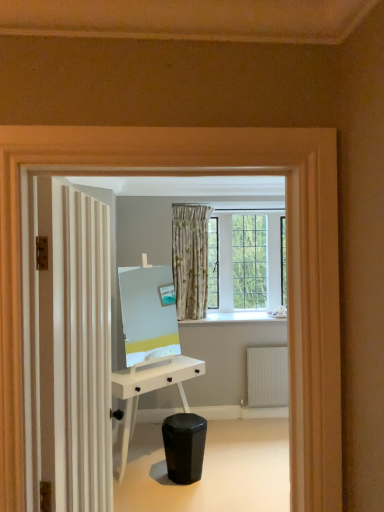
At what (x,y) coordinates should I click in order to perform the action: click on black matte swivel chair at lower center. Please return your answer as a coordinate pair (x, y). The height and width of the screenshot is (512, 384). Looking at the image, I should click on tap(184, 446).

Describe the element at coordinates (150, 391) in the screenshot. I see `white matte desk at center` at that location.

The width and height of the screenshot is (384, 512). In order to click on white textured door at left in this screenshot , I will do `click(75, 348)`.

Can you confirm if white textured door at left is positioned to the left of white ribbed radiator at lower right?

Yes, white textured door at left is to the left of white ribbed radiator at lower right.

Does white textured door at left have a lesser height compared to white ribbed radiator at lower right?

Incorrect, the height of white textured door at left does not fall short of that of white ribbed radiator at lower right.

Measure the distance between white textured door at left and white ribbed radiator at lower right.

A distance of 2.83 meters exists between white textured door at left and white ribbed radiator at lower right.

Is white textured door at left in contact with black matte swivel chair at lower center?

white textured door at left and black matte swivel chair at lower center are not in contact.

Is point (102, 379) farther from camera compared to point (174, 426)?

That is False.

From a real-world perspective, is white textured door at left on top of black matte swivel chair at lower center?

A: Correct, in the physical world, white textured door at left is higher than black matte swivel chair at lower center.

Can you confirm if white textured door at left is wider than black matte swivel chair at lower center?

In fact, white textured door at left might be narrower than black matte swivel chair at lower center.

Between black matte swivel chair at lower center and white textured door at left, which one has smaller width?

With smaller width is white textured door at left.

Considering their positions, is black matte swivel chair at lower center located in front of or behind white textured door at left?

Visually, black matte swivel chair at lower center is located behind white textured door at left.

Does black matte swivel chair at lower center appear on the left side of white textured door at left?

Incorrect, black matte swivel chair at lower center is not on the left side of white textured door at left.

Could you tell me if white ribbed radiator at lower right is facing black matte swivel chair at lower center?

No, white ribbed radiator at lower right does not turn towards black matte swivel chair at lower center.

How much distance is there between white ribbed radiator at lower right and black matte swivel chair at lower center?

A distance of 4.30 feet exists between white ribbed radiator at lower right and black matte swivel chair at lower center.

Looking at their sizes, would you say white ribbed radiator at lower right is wider or thinner than black matte swivel chair at lower center?

white ribbed radiator at lower right is thinner than black matte swivel chair at lower center.

Who is smaller, white ribbed radiator at lower right or black matte swivel chair at lower center?

white ribbed radiator at lower right.

What's the angular difference between white ribbed radiator at lower right and white textured door at left's facing directions?

The angle between the facing direction of white ribbed radiator at lower right and the facing direction of white textured door at left is 81.1 degrees.

Is white ribbed radiator at lower right inside or outside of white textured door at left?

white ribbed radiator at lower right is not enclosed by white textured door at left.

Is white ribbed radiator at lower right wider than white textured door at left?

In fact, white ribbed radiator at lower right might be narrower than white textured door at left.

Considering the sizes of objects white textured door at left and white matte desk at center in the image provided, who is shorter, white textured door at left or white matte desk at center?

Standing shorter between the two is white matte desk at center.

Would you say white textured door at left is outside white matte desk at center?

Yes.

Is white textured door at left wider than white matte desk at center?

Incorrect, the width of white textured door at left does not surpass that of white matte desk at center.

Measure the distance between white textured door at left and white matte desk at center.

white textured door at left is 1.59 meters from white matte desk at center.

Is white matte desk at center outside of black matte swivel chair at lower center?

Indeed, white matte desk at center is completely outside black matte swivel chair at lower center.

How much distance is there between white matte desk at center and black matte swivel chair at lower center?

They are 45.00 centimeters apart.

From a real-world perspective, is white matte desk at center located beneath black matte swivel chair at lower center?

Actually, white matte desk at center is physically above black matte swivel chair at lower center in the real world.

Based on the photo, is white matte desk at center touching black matte swivel chair at lower center?

white matte desk at center is not next to black matte swivel chair at lower center, and they're not touching.

I want to click on radiator that is under the white textured door at left (from a real-world perspective), so click(267, 376).

This screenshot has height=512, width=384. Find the location of `door above the black matte swivel chair at lower center (from the image's perspective)`. door above the black matte swivel chair at lower center (from the image's perspective) is located at coordinates (75, 348).

Based on their spatial positions, is white matte desk at center or white ribbed radiator at lower right closer to white textured door at left?

Among the two, white matte desk at center is located nearer to white textured door at left.

Considering their positions, is white ribbed radiator at lower right positioned closer to white textured door at left than black matte swivel chair at lower center?

black matte swivel chair at lower center is positioned closer to the anchor white textured door at left.

From the image, which object appears to be nearer to white matte desk at center, white textured door at left or white ribbed radiator at lower right?

white ribbed radiator at lower right is closer to white matte desk at center.

Which object lies further to the anchor point white ribbed radiator at lower right, white matte desk at center or black matte swivel chair at lower center?

Based on the image, black matte swivel chair at lower center appears to be further to white ribbed radiator at lower right.

Based on their spatial positions, is white ribbed radiator at lower right or white textured door at left closer to black matte swivel chair at lower center?

white ribbed radiator at lower right is positioned closer to the anchor black matte swivel chair at lower center.

Which object lies nearer to the anchor point black matte swivel chair at lower center, white textured door at left or white matte desk at center?

white matte desk at center is closer to black matte swivel chair at lower center.

Considering their positions, is white matte desk at center positioned closer to black matte swivel chair at lower center than white textured door at left?

Among the two, white matte desk at center is located nearer to black matte swivel chair at lower center.

Consider the image. Considering their positions, is black matte swivel chair at lower center positioned closer to white ribbed radiator at lower right than white matte desk at center?

Based on the image, white matte desk at center appears to be nearer to white ribbed radiator at lower right.

The width and height of the screenshot is (384, 512). I want to click on swivel chair between white textured door at left and white matte desk at center in the front-back direction, so (184, 446).

You are a GUI agent. You are given a task and a screenshot of the screen. Output one action in this format:
    pyautogui.click(x=<x>, y=<y>)
    Task: Click on the desk between black matte swivel chair at lower center and white ribbed radiator at lower right in the front-back direction
    
    Given the screenshot: What is the action you would take?
    pyautogui.click(x=150, y=391)

Locate an element on the screen. The width and height of the screenshot is (384, 512). desk positioned between white textured door at left and white ribbed radiator at lower right from near to far is located at coordinates (150, 391).

Where is `swivel chair between white textured door at left and white ribbed radiator at lower right in the front-back direction`? The height and width of the screenshot is (512, 384). swivel chair between white textured door at left and white ribbed radiator at lower right in the front-back direction is located at coordinates (184, 446).